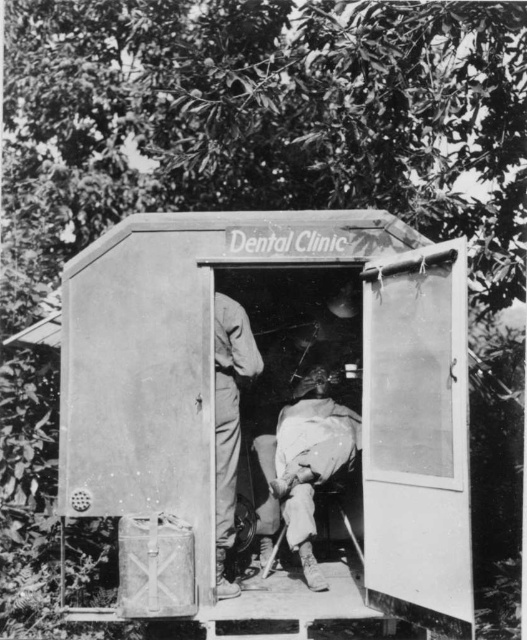
Between point (313, 372) and point (226, 481), which one is positioned behind?

Point (313, 372)

Looking at this image, is white fabric cloth at center smaller than matte khaki pants at center?

Actually, white fabric cloth at center might be larger than matte khaki pants at center.

Image resolution: width=527 pixels, height=640 pixels. In order to click on white fabric cloth at center in this screenshot , I will do `click(306, 461)`.

Can you confirm if metallic gray hut at center is taller than white fabric cloth at center?

Correct, metallic gray hut at center is much taller as white fabric cloth at center.

Is point (424, 365) in front of point (274, 520)?

Yes, point (424, 365) is closer to viewer.

Find the location of `metallic gray hut at center`. metallic gray hut at center is located at coordinates (270, 416).

Does metallic gray hut at center appear over matte khaki pants at center?

Yes, metallic gray hut at center is above matte khaki pants at center.

Is metallic gray hut at center to the left of matte khaki pants at center from the viewer's perspective?

No, metallic gray hut at center is not to the left of matte khaki pants at center.

Is point (419, 269) in front of point (217, 556)?

That is True.

This screenshot has width=527, height=640. Find the location of `metallic gray hut at center`. metallic gray hut at center is located at coordinates [270, 416].